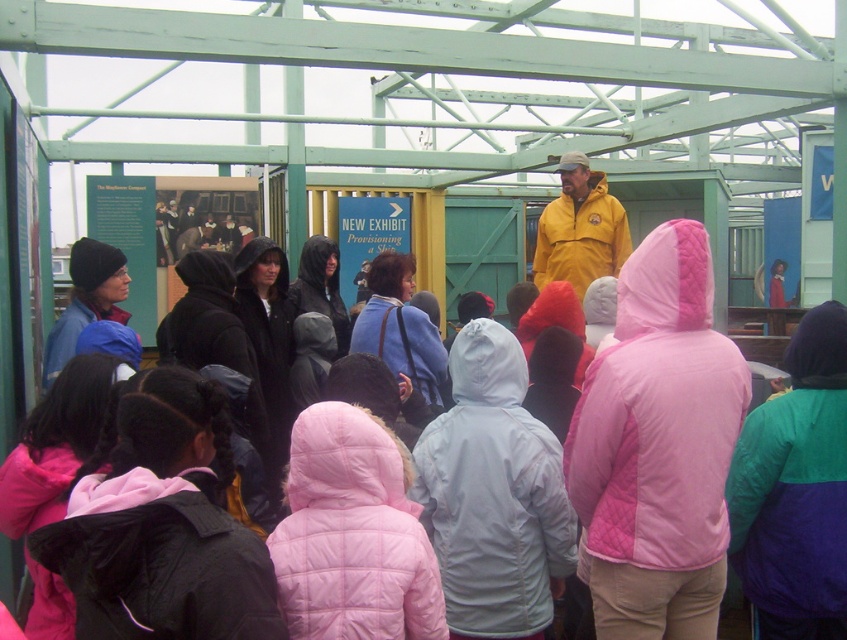
You are a photographer trying to capture both the pink quilted jacket at center and the black quilted jacket at center in the same frame. Given their sizes, which jacket should you position closer to the camera to ensure both appear equally sized in the photo?

The pink quilted jacket at center is smaller in size compared to the black quilted jacket at center. To make them appear equal in size in the photo, position the pink quilted jacket at center closer to the camera and the black quilted jacket at center farther away.